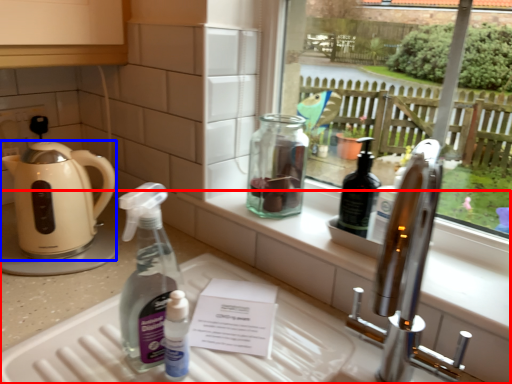
Question: Which point is further to the camera, counter (highlighted by a red box) or kettle (highlighted by a blue box)?

Choices:
 (A) counter
 (B) kettle

Answer: (B)